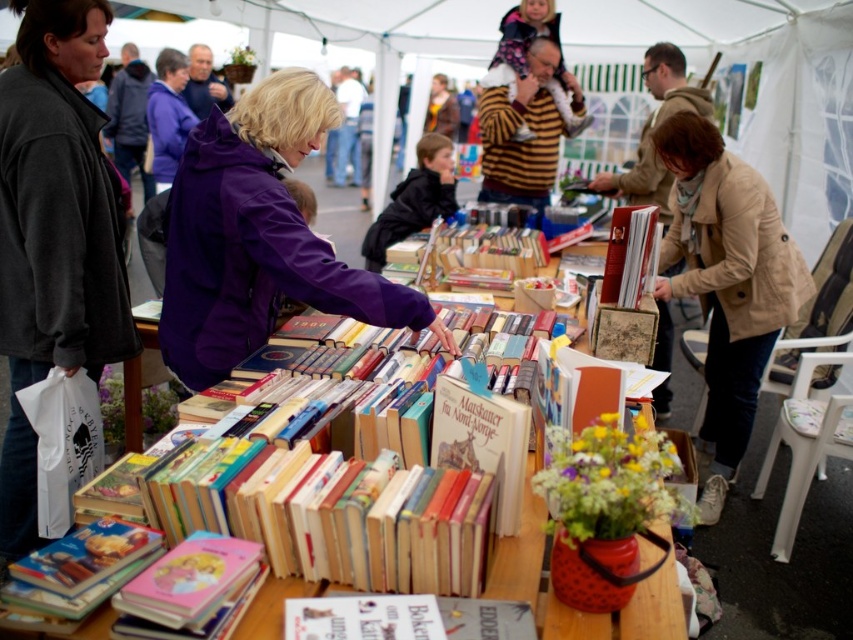
You are organizing a display at the book fair and need to place the pink matte book at lower left and the hardcover book at center on a shelf. If the shelf has limited space, which book should you place first to ensure both fit?

You should place the pink matte book at lower left first because it occupies less space than the hardcover book at center, allowing more room for the larger book afterward.

You are at the outdoor book fair and see a beige coat at lower right and a hardcover book at center. Which item is closer to the right edge of the tent?

The beige coat at lower right is closer to the right edge of the tent because it is positioned to the right of the hardcover book at center.